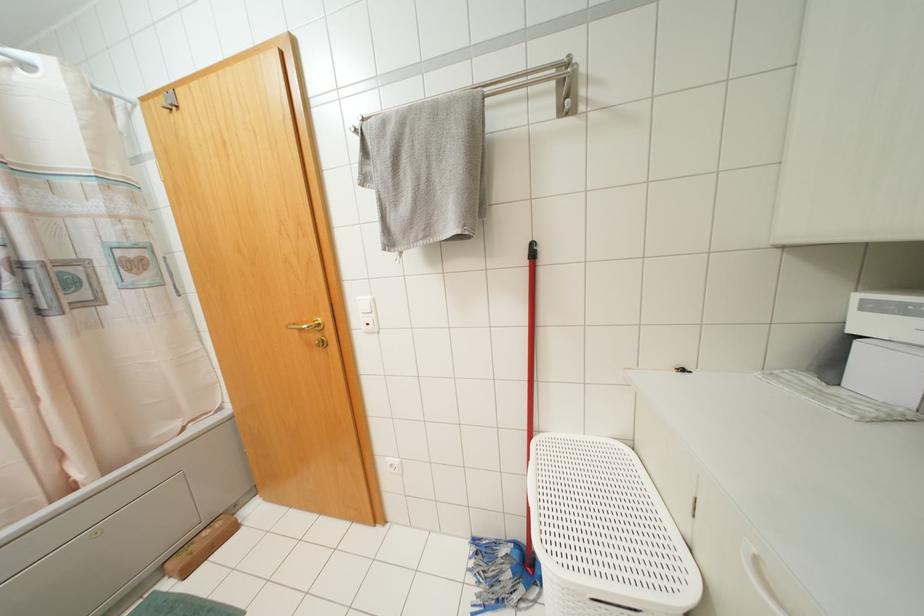
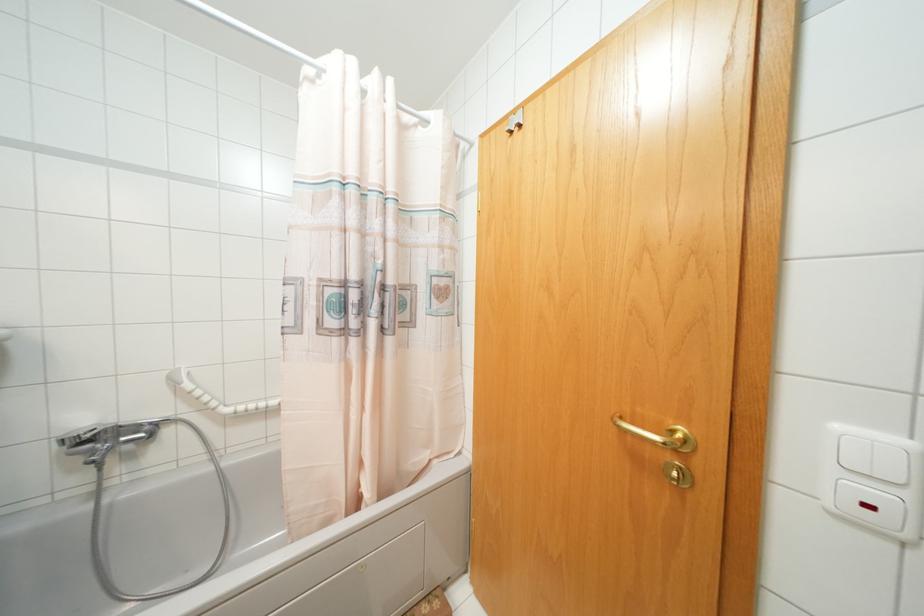
The point at (319, 323) is marked in the first image. Where is the corresponding point in the second image?

(686, 440)